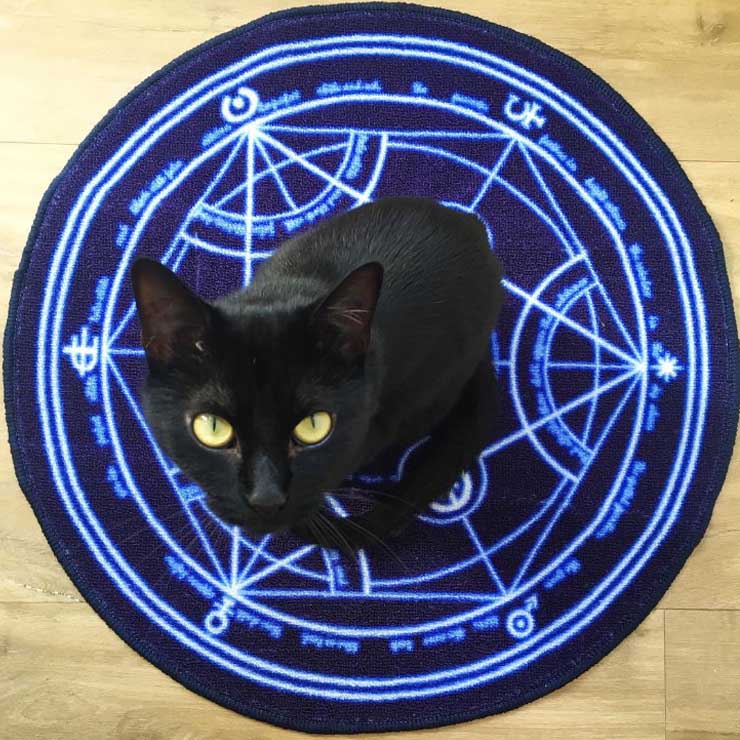
Find the location of a particular element. The height and width of the screenshot is (740, 740). hardwood flooring is located at coordinates (672, 60).